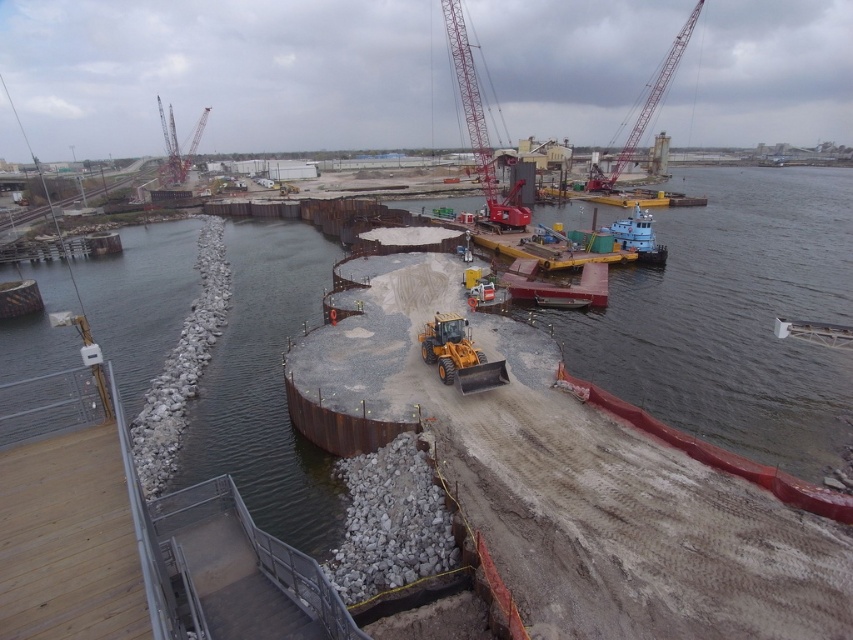
Between red metallic crane at upper center and yellow rubber at center, which one appears on the left side from the viewer's perspective?

yellow rubber at center is more to the left.

Between point (492, 182) and point (456, 323), which one is positioned in front?

Positioned in front is point (456, 323).

I want to click on red metallic crane at upper center, so click(480, 125).

Find the location of a particular element. This screenshot has height=640, width=853. red metallic crane at upper center is located at coordinates pyautogui.click(x=480, y=125).

Between red metallic crane at upper center and red metallic crane at upper left, which one has less height?

Standing shorter between the two is red metallic crane at upper left.

Can you confirm if red metallic crane at upper center is positioned to the right of red metallic crane at upper left?

Correct, you'll find red metallic crane at upper center to the right of red metallic crane at upper left.

Does point (453, 36) come behind point (204, 120)?

That is False.

I want to click on red metallic crane at upper center, so click(x=480, y=125).

Is yellow rubber at center wider than red metallic crane at upper left?

No, yellow rubber at center is not wider than red metallic crane at upper left.

Which of these two, yellow rubber at center or red metallic crane at upper left, stands shorter?

yellow rubber at center

Is point (439, 378) positioned in front of point (163, 128)?

That is True.

The image size is (853, 640). Identify the location of yellow rubber at center. (457, 355).